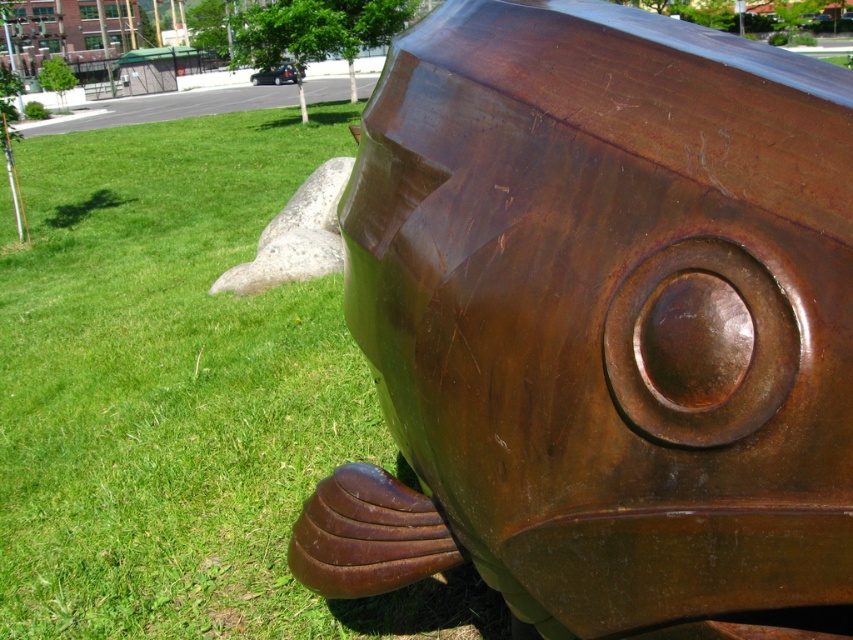
Question: Which of the following is the closest to the observer?

Choices:
 (A) (462, 545)
 (B) (248, 573)

Answer: (A)

Question: Is rusty metal fish at center smaller than green grass at lower left?

Choices:
 (A) yes
 (B) no

Answer: (A)

Question: Which point appears farthest from the camera in this image?

Choices:
 (A) [392, 262]
 (B) [425, 614]

Answer: (B)

Question: Is the position of rusty metal fish at center less distant than that of green grass at lower left?

Choices:
 (A) no
 (B) yes

Answer: (B)

Question: Does rusty metal fish at center appear on the right side of green grass at lower left?

Choices:
 (A) no
 (B) yes

Answer: (B)